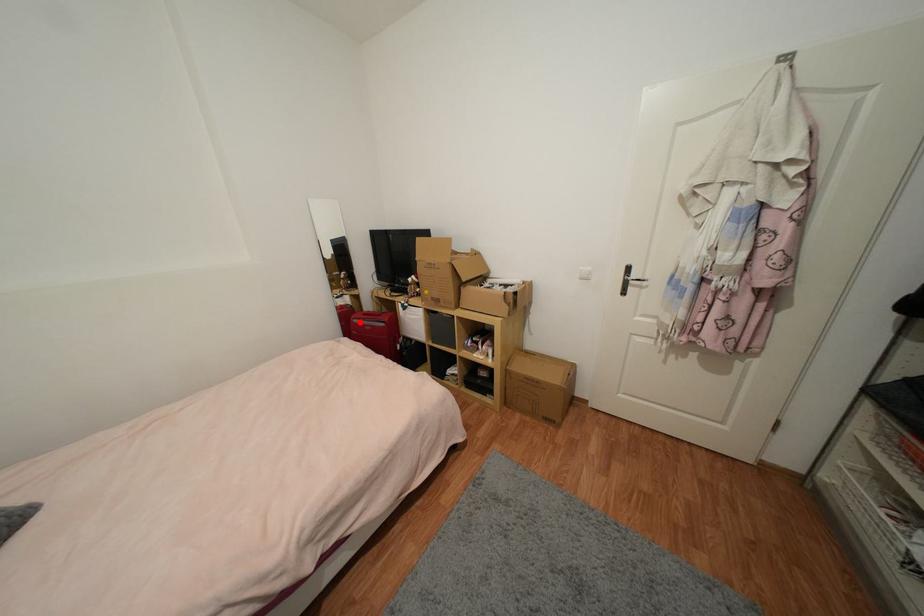
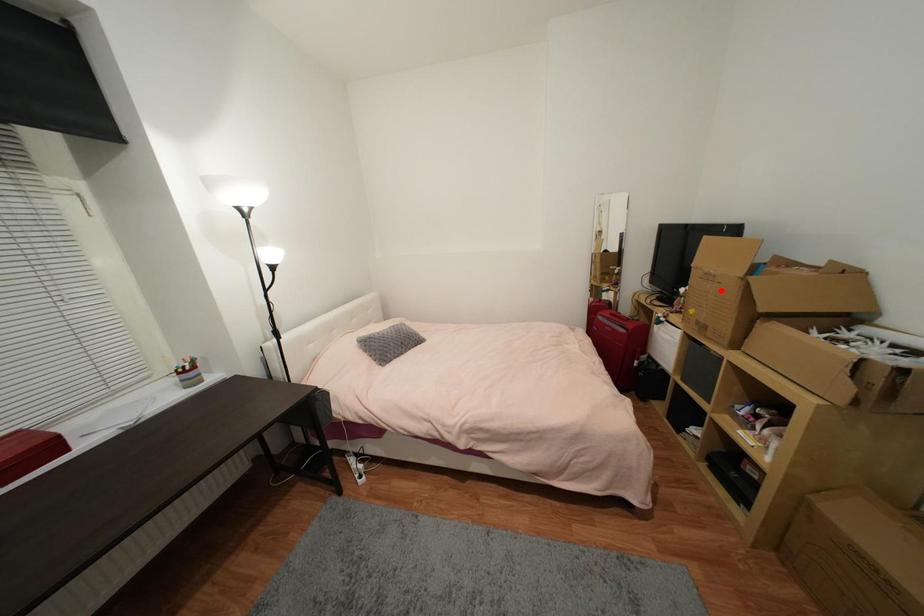
I am providing you with two images of the same scene from different viewpoints. A red point is marked on the first image and another point is marked on the second image. Does the point marked in image1 correspond to the same location as the one in image2?

No